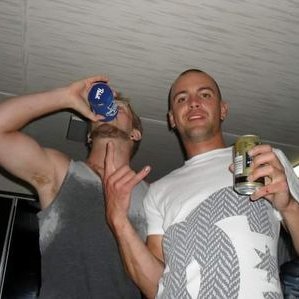
Locate an element on the screen. window is located at coordinates (23, 241).